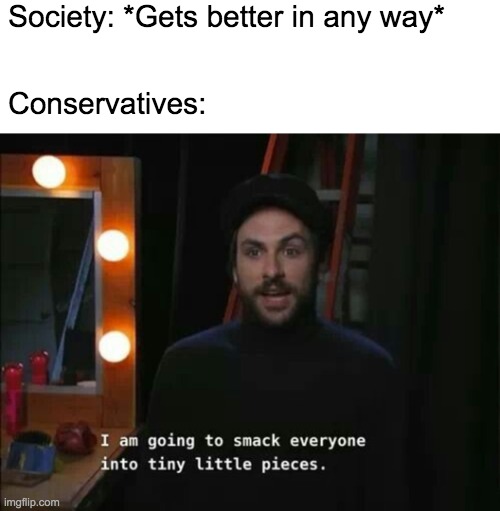
Where is `lights`? The width and height of the screenshot is (500, 511). lights is located at coordinates (52, 184), (107, 255), (111, 340).